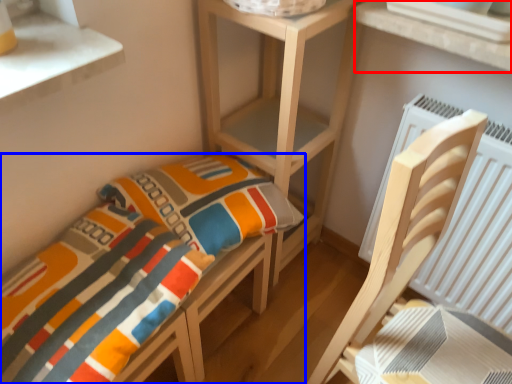
Question: Which of the following is the farthest to the observer, window (highlighted by a red box) or furniture (highlighted by a blue box)?

Choices:
 (A) window
 (B) furniture

Answer: (A)